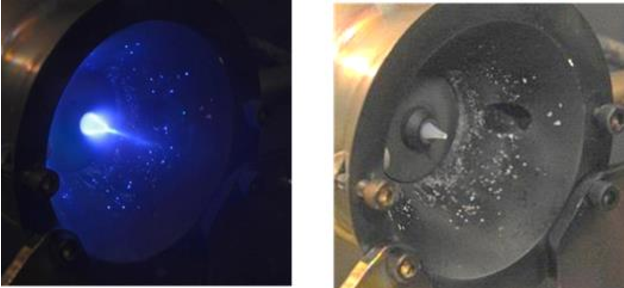
This screenshot has width=624, height=288. In order to click on screws in this screenshot , I will do `click(382, 209)`.